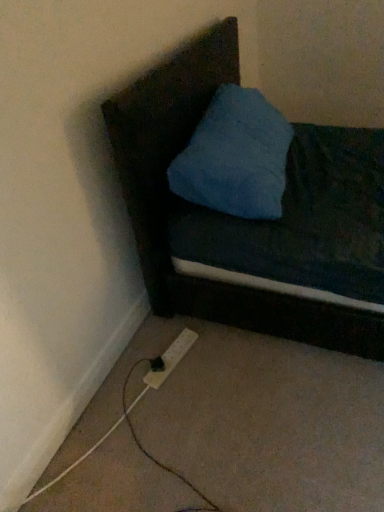
You are a GUI agent. You are given a task and a screenshot of the screen. Output one action in this format:
    pyautogui.click(x=<x>, y=<y>)
    Task: Click on the free space in front of white plastic power plugs and sockets at lower left
    The height and width of the screenshot is (512, 384).
    Given the screenshot: What is the action you would take?
    pyautogui.click(x=169, y=397)